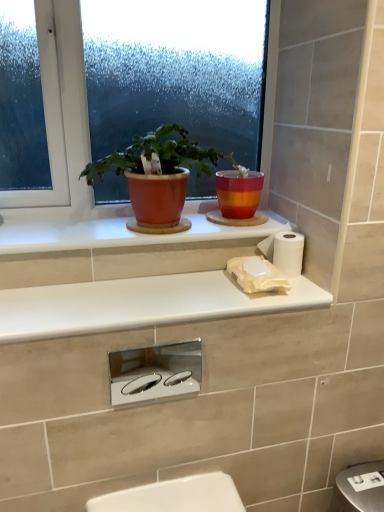
Question: From the image's perspective, is white glossy countertop at upper center, which is the first window sill in bottom-to-top order, located above or below matte orange pot at upper center?

Choices:
 (A) below
 (B) above

Answer: (A)

Question: Is white glossy countertop at upper center, which is the first window sill in bottom-to-top order, in front of or behind matte orange pot at upper center in the image?

Choices:
 (A) behind
 (B) front

Answer: (B)

Question: Estimate the real-world distances between objects in this image. Which object is closer to the matte glass window at upper center?

Choices:
 (A) chrome/polished flush plate at center
 (B) matte orange pot at upper center
 (C) white ceramic window sill at upper center, the first window sill when ordered from top to bottom
 (D) white glossy countertop at upper center, marked as the 2th window sill in a top-to-bottom arrangement
 (E) white matte toilet paper at right

Answer: (C)

Question: Which object is positioned farthest from the white glossy countertop at upper center, marked as the 2th window sill in a top-to-bottom arrangement?

Choices:
 (A) matte orange pot at upper center
 (B) white matte toilet paper at right
 (C) matte glass window at upper center
 (D) white ceramic window sill at upper center, which ranks as the 2th window sill in bottom-to-top order
 (E) chrome/polished flush plate at center

Answer: (C)